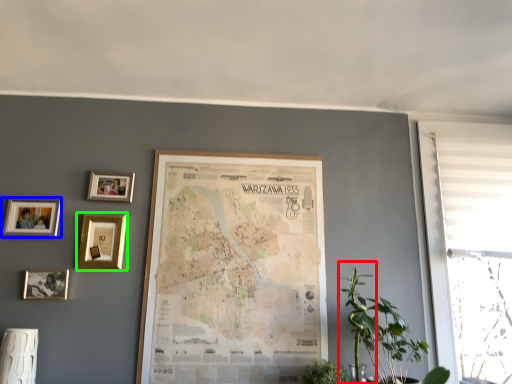
Question: Considering the real-world distances, which object is farthest from plant (highlighted by a red box)? picture frame (highlighted by a blue box) or picture frame (highlighted by a green box)?

Choices:
 (A) picture frame
 (B) picture frame

Answer: (A)